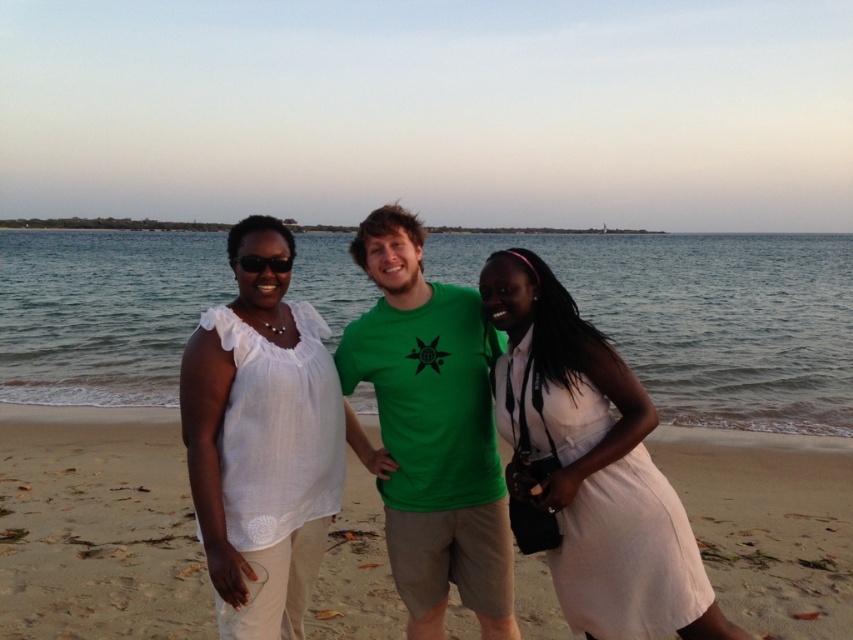
Is point (450, 632) closer to viewer compared to point (448, 570)?

No, (450, 632) is behind (448, 570).

Who is positioned more to the left, sandy beach at center or green matte t-shirt at center?

Positioned to the left is green matte t-shirt at center.

Locate an element on the screen. This screenshot has width=853, height=640. sandy beach at center is located at coordinates (97, 525).

Is clear blue water at center wider than white linen blouse at center?

Yes.

Can you confirm if clear blue water at center is shorter than white linen blouse at center?

No, clear blue water at center is not shorter than white linen blouse at center.

Locate an element on the screen. This screenshot has width=853, height=640. clear blue water at center is located at coordinates (706, 317).

Is sandy beach at center shorter than white linen blouse at center?

Indeed, sandy beach at center has a lesser height compared to white linen blouse at center.

Where is `sandy beach at center`? The width and height of the screenshot is (853, 640). sandy beach at center is located at coordinates (97, 525).

The height and width of the screenshot is (640, 853). What are the coordinates of `sandy beach at center` in the screenshot? It's located at (97, 525).